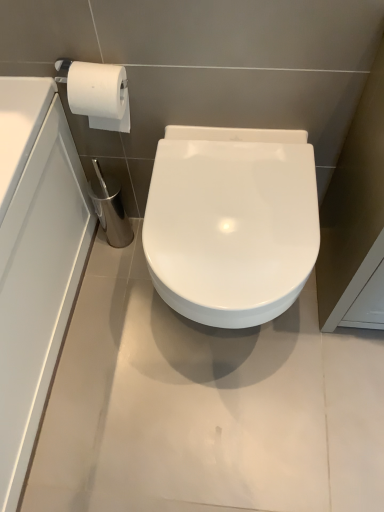
The image size is (384, 512). What are the coordinates of `free space above white glossy toilet at center (from a real-world perspective)` in the screenshot? It's located at (229, 203).